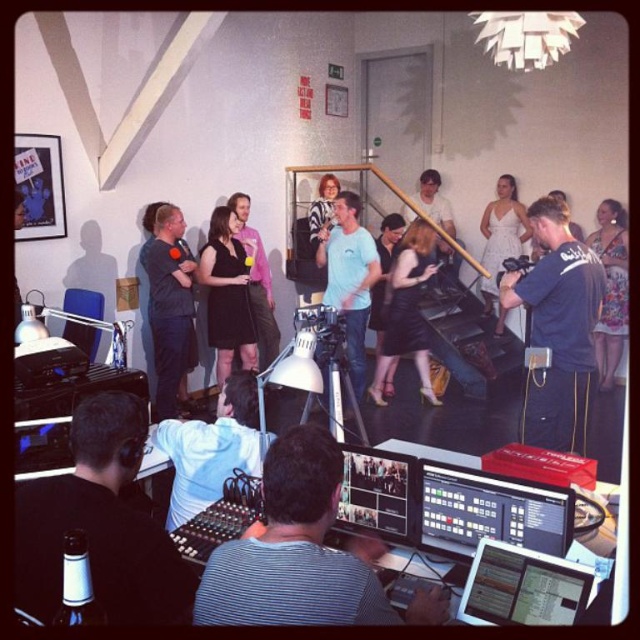
Question: Which object is closer to the camera taking this photo?

Choices:
 (A) floral dress at center
 (B) light blue shirt at center
 (C) black satin dress at center
 (D) dark blue fabric camera at center

Answer: (B)

Question: Can you confirm if black matte headphones at lower left is thinner than floral dress at center?

Choices:
 (A) yes
 (B) no

Answer: (B)

Question: Does black matte headphones at lower left have a greater width compared to dark blue shirt at center?

Choices:
 (A) no
 (B) yes

Answer: (B)

Question: Which point is closer to the camera?

Choices:
 (A) striped shirt at center
 (B) dark blue fabric camera at center
 (C) light blue t-shirt at center
 (D) light blue shirt at center

Answer: (A)

Question: Can you confirm if black leather dress at center is wider than white satin dress at center?

Choices:
 (A) yes
 (B) no

Answer: (A)

Question: Which point is farther to the camera?

Choices:
 (A) (163, 404)
 (B) (563, 419)

Answer: (A)